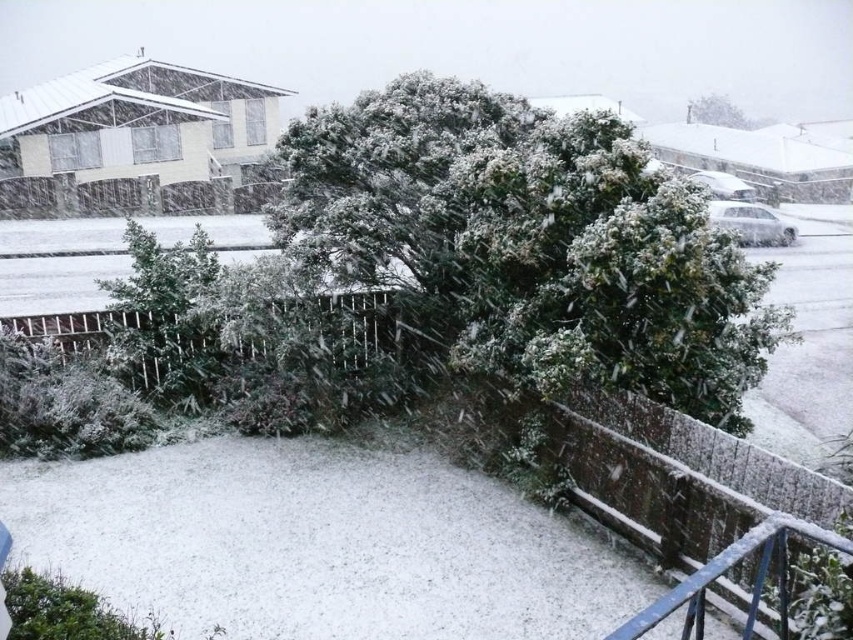
What do you see at coordinates (532, 243) in the screenshot? Image resolution: width=853 pixels, height=640 pixels. I see `green matte bush at center` at bounding box center [532, 243].

Who is taller, green matte bush at center or green leafy bush at upper center?

green leafy bush at upper center

Who is more distant from viewer, (x=312, y=129) or (x=727, y=116)?

Point (x=727, y=116)

You are a GUI agent. You are given a task and a screenshot of the screen. Output one action in this format:
    pyautogui.click(x=<x>, y=<y>)
    Task: Click on the green matte bush at center
    This screenshot has height=640, width=853.
    Given the screenshot: What is the action you would take?
    pyautogui.click(x=532, y=243)